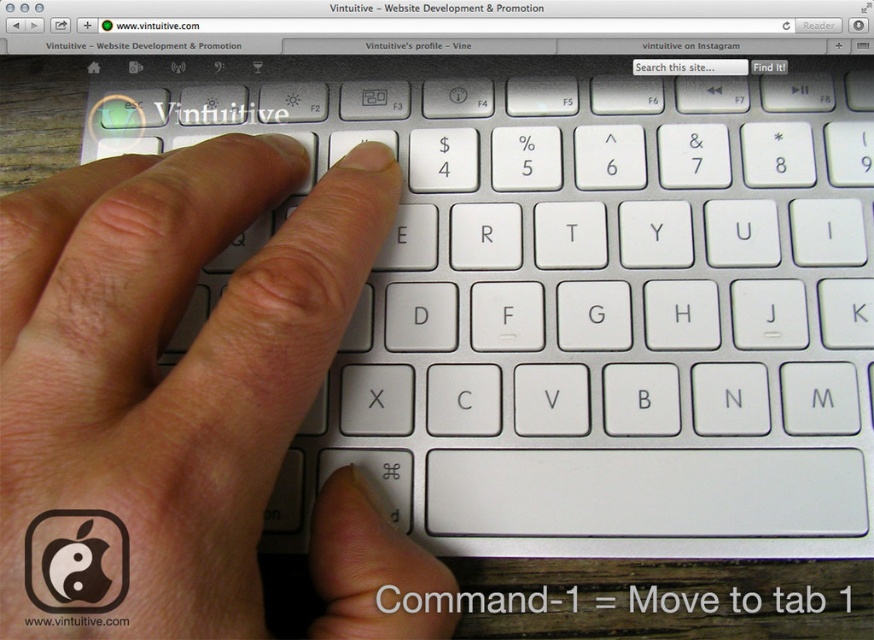
You are designing a mobile app interface and need to ensure that the buttons are large enough for users to interact with comfortably. You have a reference image of a hand interacting with a keyboard. In the image, there is a white plastic keyboard at center and a white matte finger at center. Based on the size comparison between these two objects, what should you consider when designing button sizes for the app?

The white plastic keyboard at center is bigger than the white matte finger at center, so buttons on the app should be designed to be at least as large as the keyboard keys to ensure they are comfortably clickable by users.

You are taking a photo of the keyboard and want to focus on the Command key. Which point, point 1 at coordinates (616, 68) or point 2 at coordinates (175, 456), is closer to the camera and should you focus on it to ensure the Command key is sharp?

Point 1 at coordinates (616, 68) is further to the camera than point 2 at coordinates (175, 456). Therefore, to focus on the Command key, you should focus on point 2 at coordinates (175, 456) since it is closer to the camera.

You are a photographer trying to capture a closeup of the keyboard in the scene. The camera is positioned at a certain distance. If you want to focus on the point labeled as point (x=429, y=300), which is 20.46 inches away from the camera, will the current distance allow the keyboard to be in focus? Please explain your reasoning.

The point labeled as point (x=429, y=300) is 20.46 inches away from the camera. Since the keyboard is part of the same plane as this point, the entire keyboard will be in focus if the camera is focused at that point, assuming the depth of field is sufficient to cover the entire keyboard.